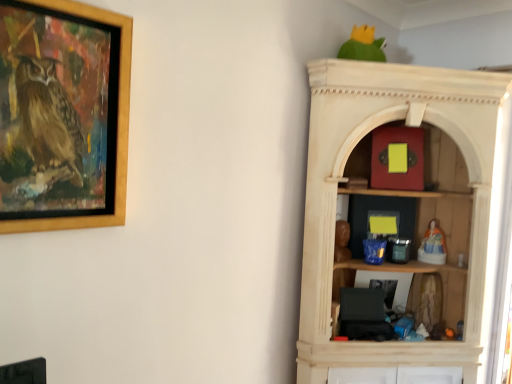
Question: From the image's perspective, is wooden picture frame at upper left located above or below porcelain figurine at right, positioned as the third toy in top-to-bottom order?

Choices:
 (A) above
 (B) below

Answer: (A)

Question: In terms of size, does wooden picture frame at upper left appear bigger or smaller than porcelain figurine at right, which ranks as the 4th toy in left-to-right order?

Choices:
 (A) small
 (B) big

Answer: (B)

Question: Which is nearer to the matte red box at upper center, the 4th toy ordered from the bottom?

Choices:
 (A) wooden statue at center, the 1th toy positioned from the left
 (B) wooden picture frame at upper left
 (C) green matte parrot at upper center
 (D) porcelain figurine at right, positioned as the third toy in top-to-bottom order
 (E) fuzzy fabric doll at right, placed as the 3th toy when sorted from left to right

Answer: (D)

Question: Which of these objects is positioned farthest from the fuzzy fabric doll at right, which is the second toy from right to left?

Choices:
 (A) matte red box at upper center, the 4th toy ordered from the bottom
 (B) wooden statue at center, arranged as the second toy when viewed from the top
 (C) porcelain figurine at right, marked as the second toy in a bottom-to-top arrangement
 (D) green matte parrot at upper center
 (E) wooden picture frame at upper left

Answer: (E)